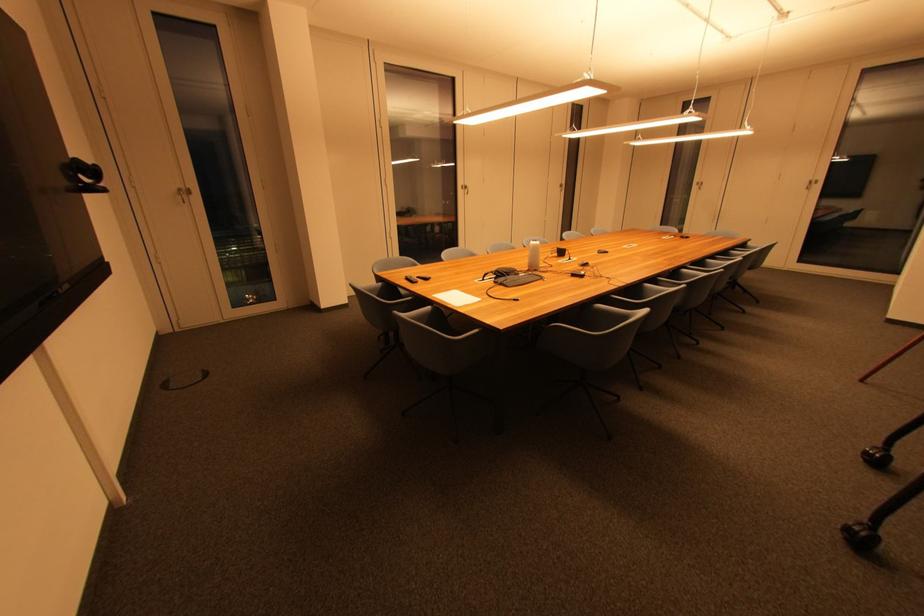
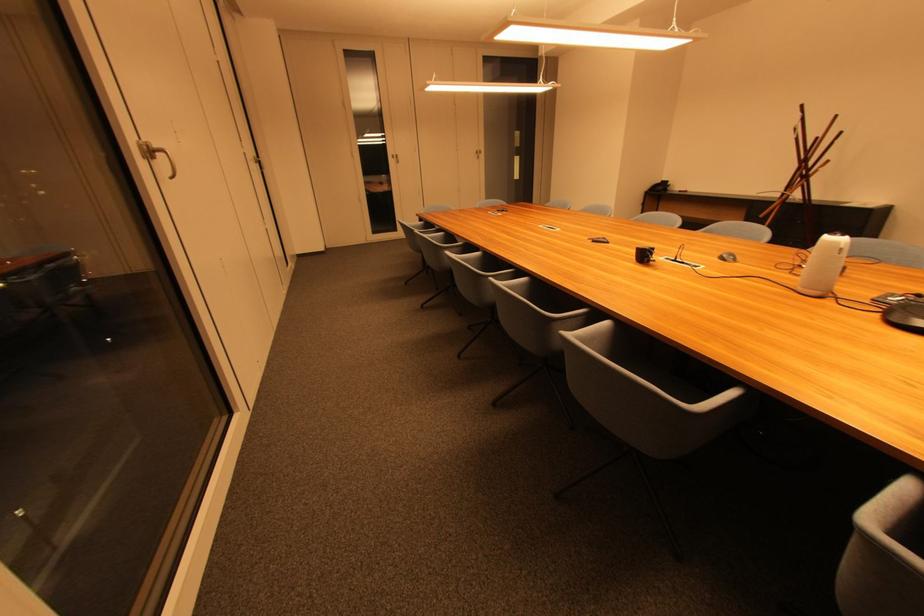
Where in the second image is the point corresponding to (x=468, y=190) from the first image?

(148, 159)